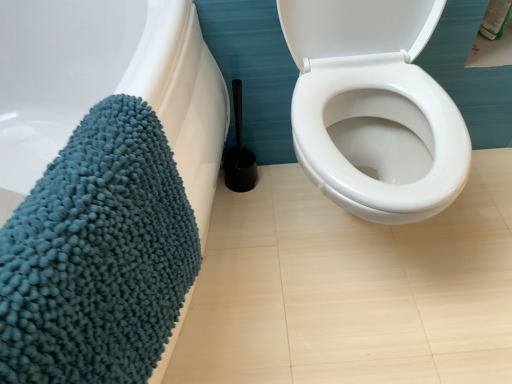
The width and height of the screenshot is (512, 384). Find the location of `free space in front of black plastic toilet brush at center`. free space in front of black plastic toilet brush at center is located at coordinates (248, 218).